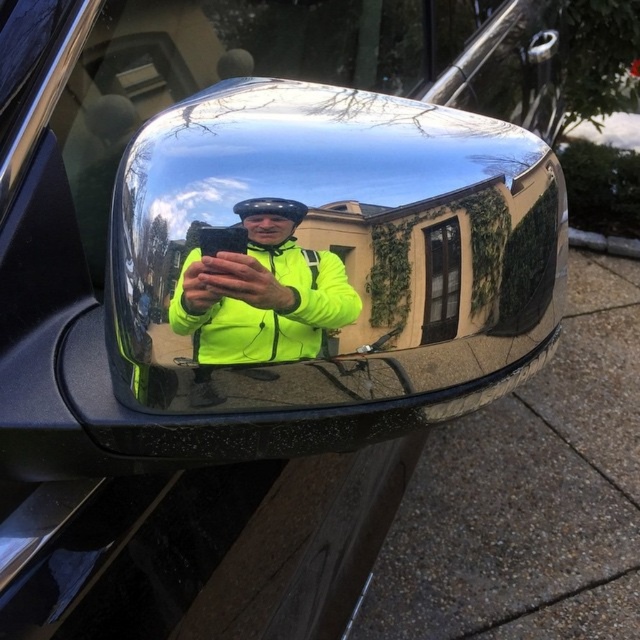
Measure the distance between point (221, 362) and camera.

Point (221, 362) and camera are 38.28 centimeters apart.

Does neon yellow jacket at center appear over clear glass window at center?

Actually, neon yellow jacket at center is below clear glass window at center.

Which is in front, point (355, 314) or point (428, 321)?

Point (355, 314)

Identify the location of neon yellow jacket at center. (262, 292).

Does chrome reflective mirror at center have a lesser width compared to clear glass window at center?

In fact, chrome reflective mirror at center might be wider than clear glass window at center.

Which is behind, point (513, 256) or point (444, 268)?

The point (513, 256) is behind.

Is point (208, 157) farther from viewer compared to point (456, 230)?

No, (208, 157) is closer to viewer.

This screenshot has width=640, height=640. In order to click on chrome reflective mirror at center in this screenshot , I will do `click(333, 236)`.

Between chrome reflective mirror at center and neon yellow jacket at center, which one appears on the right side from the viewer's perspective?

chrome reflective mirror at center

Does chrome reflective mirror at center have a lesser width compared to neon yellow jacket at center?

No, chrome reflective mirror at center is not thinner than neon yellow jacket at center.

Which is behind, point (461, 131) or point (268, 209)?

The point (461, 131) is behind.

Identify the location of chrome reflective mirror at center. (333, 236).